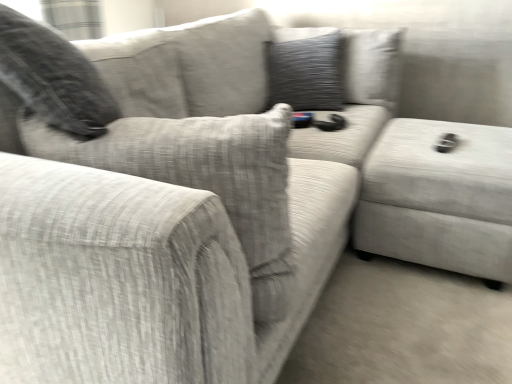
The width and height of the screenshot is (512, 384). Describe the element at coordinates (439, 198) in the screenshot. I see `textured fabric ottoman at right` at that location.

Identify the location of textured fabric ottoman at right. coord(439,198).

What is the approximate height of textured fabric ottoman at right?

16.97 inches.

What do you see at coordinates (305, 73) in the screenshot? The height and width of the screenshot is (384, 512). I see `textured gray pillow at upper center` at bounding box center [305, 73].

Measure the distance between point [318,50] and camera.

The depth of point [318,50] is 6.27 feet.

From the picture: What is the approximate width of textured gray pillow at upper center?

It is 23.29 centimeters.

Identify the location of textured gray pillow at upper center. This screenshot has height=384, width=512. (305, 73).

This screenshot has height=384, width=512. What are the coordinates of `textured fabric ottoman at right` in the screenshot? It's located at (439, 198).

Between textured gray pillow at upper center and textured fabric ottoman at right, which one appears on the left side from the viewer's perspective?

From the viewer's perspective, textured gray pillow at upper center appears more on the left side.

Considering the relative positions of textured gray pillow at upper center and textured fabric ottoman at right in the image provided, is textured gray pillow at upper center behind textured fabric ottoman at right?

That is True.

Which point is more distant from viewer, (280, 93) or (461, 240)?

Point (280, 93)

From the image's perspective, relative to textured fabric ottoman at right, is textured gray pillow at upper center above or below?

textured gray pillow at upper center is situated higher than textured fabric ottoman at right in the image.

From a real-world perspective, is textured gray pillow at upper center physically located above or below textured fabric ottoman at right?

From a real-world perspective, textured gray pillow at upper center is physically above textured fabric ottoman at right.

Considering the sizes of objects textured gray pillow at upper center and textured fabric ottoman at right in the image provided, who is wider, textured gray pillow at upper center or textured fabric ottoman at right?

With larger width is textured fabric ottoman at right.

From their relative heights in the image, would you say textured gray pillow at upper center is taller or shorter than textured fabric ottoman at right?

In the image, textured gray pillow at upper center appears to be taller than textured fabric ottoman at right.

Does textured gray pillow at upper center have a larger size compared to textured fabric ottoman at right?

No, textured gray pillow at upper center is not bigger than textured fabric ottoman at right.

Is textured gray pillow at upper center completely or partially outside of textured fabric ottoman at right?

Yes, textured gray pillow at upper center is outside of textured fabric ottoman at right.

Based on the photo, is textured gray pillow at upper center not close to textured fabric ottoman at right?

No, textured gray pillow at upper center is not far from textured fabric ottoman at right.

Could you tell me if textured gray pillow at upper center is facing textured fabric ottoman at right?

No.

What's the angular difference between textured gray pillow at upper center and textured fabric ottoman at right's facing directions?

88 degrees.

This screenshot has height=384, width=512. Find the location of `gray located on the right of textured gray pillow at upper center`. gray located on the right of textured gray pillow at upper center is located at coordinates (439, 198).

Which is more to the left, textured fabric ottoman at right or textured gray pillow at upper center?

textured gray pillow at upper center is more to the left.

Which object is closer to the camera taking this photo, textured fabric ottoman at right or textured gray pillow at upper center?

Positioned in front is textured fabric ottoman at right.

Is point (402, 164) in front of point (267, 56)?

Yes, it is in front of point (267, 56).

From the image's perspective, which object appears higher, textured fabric ottoman at right or textured gray pillow at upper center?

From the image's view, textured gray pillow at upper center is above.

From a real-world perspective, relative to textured gray pillow at upper center, is textured fabric ottoman at right vertically above or below?

textured fabric ottoman at right is below textured gray pillow at upper center.

Looking at their sizes, would you say textured fabric ottoman at right is wider or thinner than textured gray pillow at upper center?

Considering their sizes, textured fabric ottoman at right looks broader than textured gray pillow at upper center.

Can you confirm if textured fabric ottoman at right is shorter than textured gray pillow at upper center?

Yes.

Between textured fabric ottoman at right and textured gray pillow at upper center, which one has larger size?

textured fabric ottoman at right.

Would you say textured fabric ottoman at right is outside textured gray pillow at upper center?

textured fabric ottoman at right is positioned outside textured gray pillow at upper center.

Are textured fabric ottoman at right and textured gray pillow at upper center far apart?

textured fabric ottoman at right is near textured gray pillow at upper center, not far away.

Is textured gray pillow at upper center at the back of textured fabric ottoman at right?

textured fabric ottoman at right does not have its back to textured gray pillow at upper center.

How different are the orientations of textured fabric ottoman at right and textured gray pillow at upper center in degrees?

88 degrees.

Measure the distance between textured fabric ottoman at right and textured gray pillow at upper center.

They are 24.78 inches apart.

Where is `gray below the textured gray pillow at upper center (from a real-world perspective)`? This screenshot has height=384, width=512. gray below the textured gray pillow at upper center (from a real-world perspective) is located at coordinates (439, 198).

The height and width of the screenshot is (384, 512). Find the location of `gray on the right of textured gray pillow at upper center`. gray on the right of textured gray pillow at upper center is located at coordinates (439, 198).

At what (x,y) coordinates should I click in order to perform the action: click on pillow located above the textured fabric ottoman at right (from a real-world perspective). Please return your answer as a coordinate pair (x, y). Looking at the image, I should click on (305, 73).